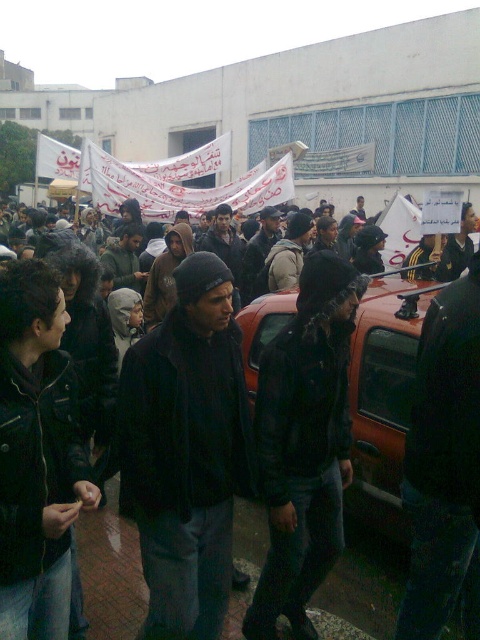
Which of these two, black matte jacket at center or black leather jacket at center, stands shorter?

Standing shorter between the two is black matte jacket at center.

Looking at this image, is black matte jacket at center behind black leather jacket at center?

No, it is in front of black leather jacket at center.

The image size is (480, 640). In order to click on black matte jacket at center in this screenshot , I will do `click(187, 451)`.

Can you confirm if black leather jacket at center is positioned below orange matte car at center?

Indeed, black leather jacket at center is positioned under orange matte car at center.

Does black leather jacket at center appear on the right side of orange matte car at center?

No, black leather jacket at center is not to the right of orange matte car at center.

Which is in front, point (302, 465) or point (264, 332)?

Positioned in front is point (302, 465).

The image size is (480, 640). I want to click on black leather jacket at center, so click(x=304, y=444).

Between black matte jacket at center and orange matte car at center, which one is positioned lower?

Positioned lower is black matte jacket at center.

Between black matte jacket at center and orange matte car at center, which one has more height?

With more height is orange matte car at center.

What do you see at coordinates (187, 451) in the screenshot? The image size is (480, 640). I see `black matte jacket at center` at bounding box center [187, 451].

What are the coordinates of `black matte jacket at center` in the screenshot? It's located at (187, 451).